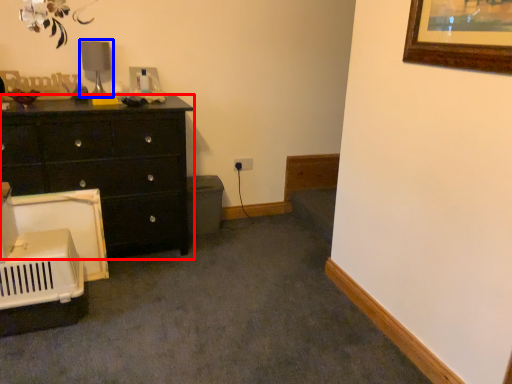
Question: Which object is closer to the camera taking this photo, chest of drawers (highlighted by a red box) or table lamp (highlighted by a blue box)?

Choices:
 (A) chest of drawers
 (B) table lamp

Answer: (A)